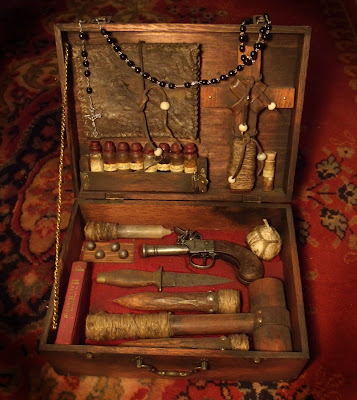
At what (x,y) coordinates should I click in order to perform the action: click on knife handle. Please return your answer as a coordinate pair (x, y). Image resolution: width=357 pixels, height=400 pixels. Looking at the image, I should click on (132, 279).